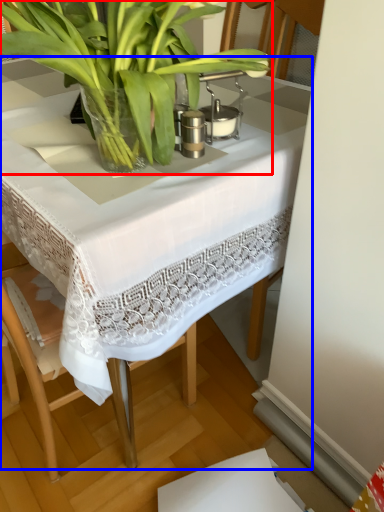
Question: Which point is closer to the camera, houseplant (highlighted by a red box) or table (highlighted by a blue box)?

Choices:
 (A) houseplant
 (B) table

Answer: (A)